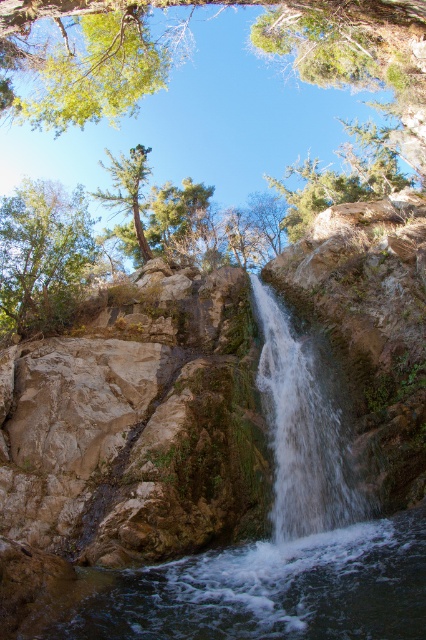
Who is positioned more to the left, clear water at center or green leafy tree at upper left?

green leafy tree at upper left is more to the left.

Is clear water at center below green leafy tree at upper left?

Correct, clear water at center is located below green leafy tree at upper left.

Identify the location of clear water at center. The width and height of the screenshot is (426, 640). (273, 589).

Between white textured water at center and green matte tree at upper center, which one appears on the right side from the viewer's perspective?

white textured water at center

Which is behind, point (324, 499) or point (138, 244)?

Point (138, 244)

Locate an element on the screen. This screenshot has height=640, width=426. white textured water at center is located at coordinates (302, 429).

Does clear water at center have a greater width compared to white textured water at center?

Indeed, clear water at center has a greater width compared to white textured water at center.

Can you confirm if clear water at center is shorter than white textured water at center?

Yes, clear water at center is shorter than white textured water at center.

The height and width of the screenshot is (640, 426). What are the coordinates of `clear water at center` in the screenshot? It's located at click(x=273, y=589).

This screenshot has width=426, height=640. Find the location of `clear water at center`. clear water at center is located at coordinates (273, 589).